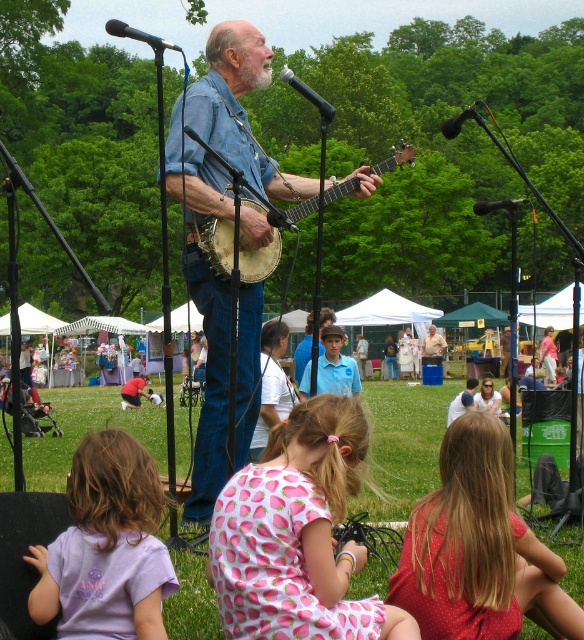
Between polka dot fabric dress at lower right and smooth brown hair at lower right, which one has less height?

Standing shorter between the two is smooth brown hair at lower right.

Which is above, polka dot fabric dress at lower right or smooth brown hair at lower right?

polka dot fabric dress at lower right is higher up.

What do you see at coordinates (478, 548) in the screenshot? The width and height of the screenshot is (584, 640). I see `polka dot fabric dress at lower right` at bounding box center [478, 548].

Locate an element on the screen. The height and width of the screenshot is (640, 584). polka dot fabric dress at lower right is located at coordinates (478, 548).

Is the position of denim shirt at center less distant than that of purple cotton shirt at lower left?

No, it is not.

Who is more forward, (239, 392) or (109, 531)?

Point (109, 531)

You are a GUI agent. You are given a task and a screenshot of the screen. Output one action in this format:
    pyautogui.click(x=<x>, y=<y>)
    Task: Click on the denim shirt at center
    The image size is (584, 640).
    Given the screenshot: What is the action you would take?
    pyautogui.click(x=238, y=108)

Is pink fabric dress at lower center to the right of light brown wooden banjo at center from the viewer's perspective?

In fact, pink fabric dress at lower center is to the left of light brown wooden banjo at center.

The height and width of the screenshot is (640, 584). Describe the element at coordinates (297, 534) in the screenshot. I see `pink fabric dress at lower center` at that location.

The height and width of the screenshot is (640, 584). I want to click on pink fabric dress at lower center, so click(297, 534).